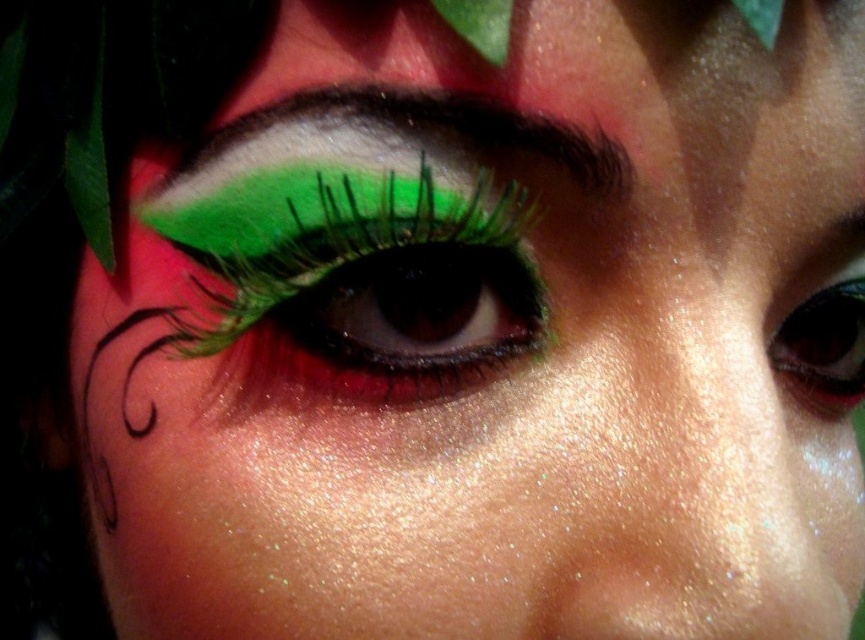
Question: Does green matte eyeliner at center have a larger size compared to dark brown eyebrow at upper center?

Choices:
 (A) yes
 (B) no

Answer: (A)

Question: Among these objects, which one is farthest from the camera?

Choices:
 (A) shiny black eye at center
 (B) green matte eyeliner at center
 (C) dark brown eyebrow at upper center

Answer: (A)

Question: Which point is closer to the camera?

Choices:
 (A) green matte eyeliner at center
 (B) shiny black eye at center

Answer: (A)

Question: Does green matte eyeliner at center lie behind shiny black eye at center?

Choices:
 (A) yes
 (B) no

Answer: (B)

Question: Is green matte eyeliner at center smaller than shiny black eye at center?

Choices:
 (A) no
 (B) yes

Answer: (A)

Question: Estimate the real-world distances between objects in this image. Which object is closer to the dark brown eyebrow at upper center?

Choices:
 (A) green matte eyeliner at center
 (B) shiny black eye at center

Answer: (A)